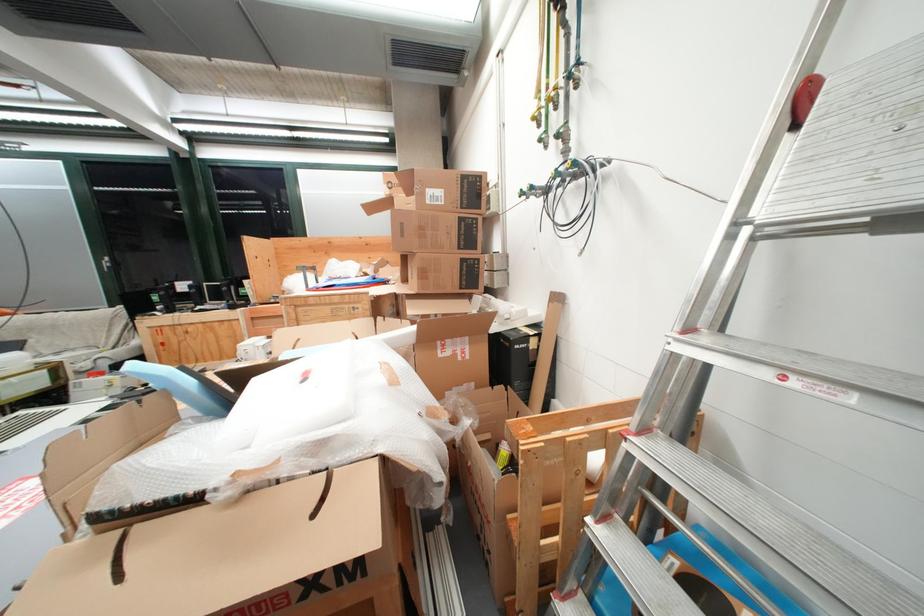
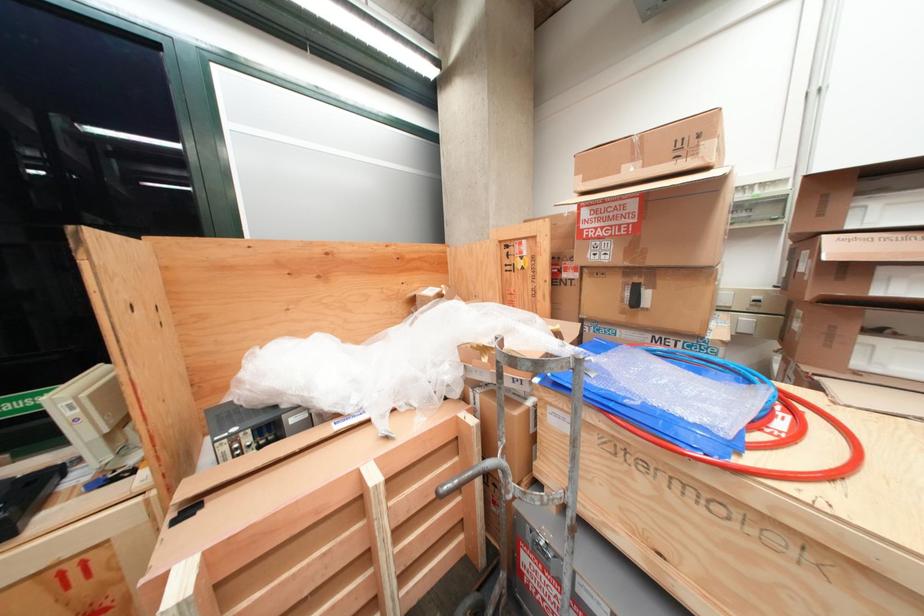
Which direction would the cameraman need to move to produce the second image?

The movement direction of the cameraman is left, forward.